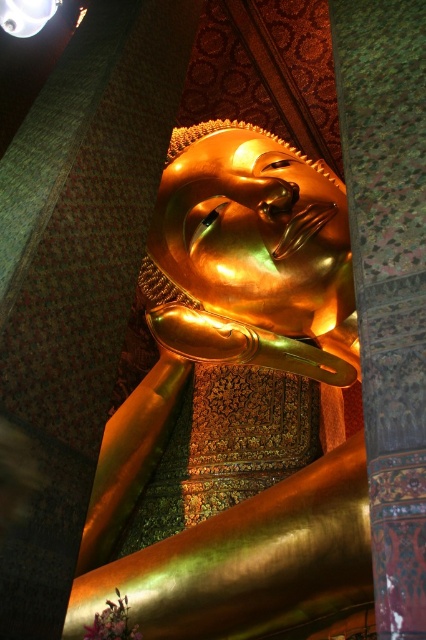
You are an art student visiting a temple and want to sketch the gold polished statue at center. You notice a metallic dome at upper left in the same scene. Based on their positions, where should you position yourself to capture both objects in your drawing?

To capture both the gold polished statue at center and the metallic dome at upper left in your drawing, position yourself so that the gold polished statue at center is centered in your view and the metallic dome at upper left is placed at the upper left corner of your sketch. Since the gold polished statue at center is located below the metallic dome at upper left, this arrangement will ensure both elements are included in the composition.

You are an architect designing a new temple and want to ensure the gold polished statue at center and the metallic dome at upper left are proportionally balanced. Given their heights, which object should be placed closer to the entrance to maintain visual harmony?

The gold polished statue at center is taller than the metallic dome at upper left, so placing the metallic dome at upper left closer to the entrance would help balance the composition by counterbalancing the statue.